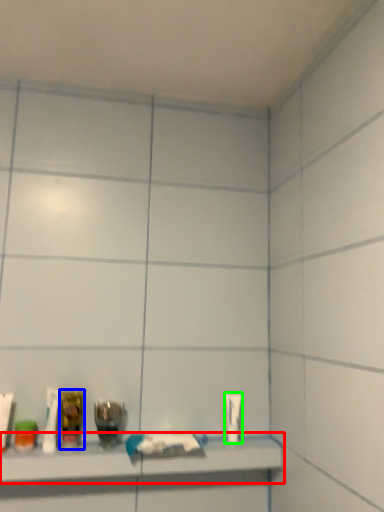
Question: Which is nearer to the shelf (highlighted by a red box)? mouthwash (highlighted by a blue box) or toiletry (highlighted by a green box).

Choices:
 (A) mouthwash
 (B) toiletry

Answer: (A)